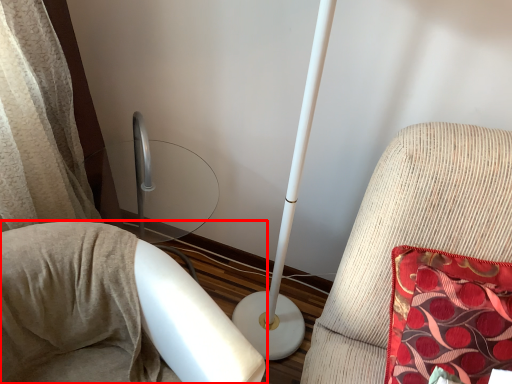
Question: From the image's perspective, where is furniture (annotated by the red box) located in relation to furniture in the image?

Choices:
 (A) above
 (B) below

Answer: (B)